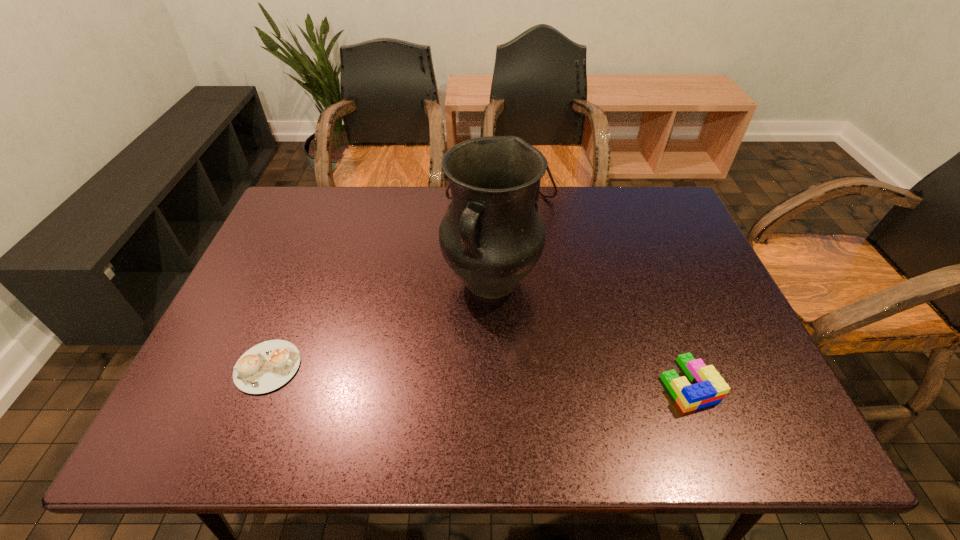
Locate an element on the screen. vacant space that satisfies the following two spatial constraints: 1. on the front side of the second shortest object; 2. on the right side of the tallest object is located at coordinates (493, 383).